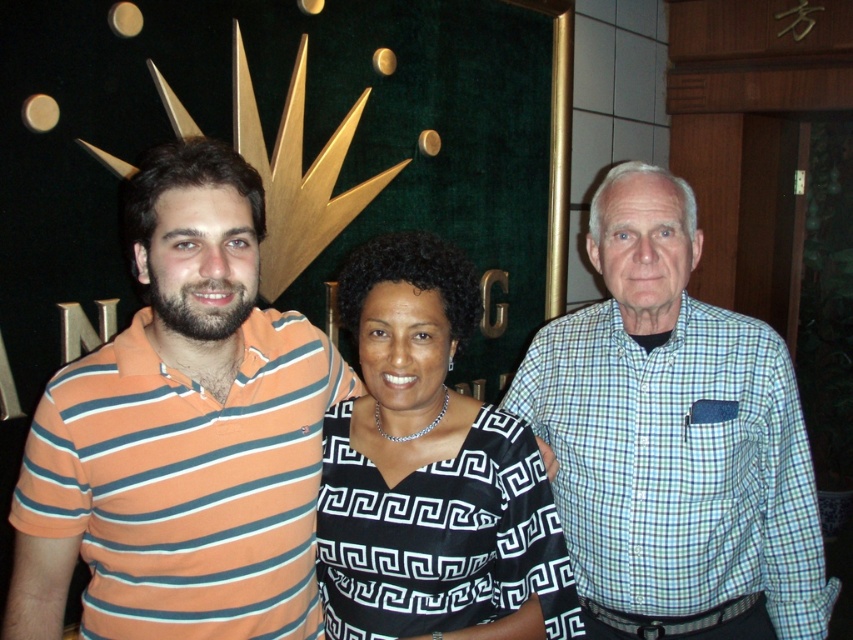
Can you confirm if orange striped polo shirt at left is positioned to the left of light blue checkered shirt at center?

Correct, you'll find orange striped polo shirt at left to the left of light blue checkered shirt at center.

Is orange striped polo shirt at left thinner than light blue checkered shirt at center?

Yes, orange striped polo shirt at left is thinner than light blue checkered shirt at center.

Is point (213, 490) behind point (566, 337)?

No, (213, 490) is closer to viewer.

Locate an element on the screen. orange striped polo shirt at left is located at coordinates (181, 435).

Between light blue checkered shirt at center and black silk dress at center, which one appears on the right side from the viewer's perspective?

From the viewer's perspective, light blue checkered shirt at center appears more on the right side.

Where is `light blue checkered shirt at center`? The width and height of the screenshot is (853, 640). light blue checkered shirt at center is located at coordinates (672, 440).

Consider the image. Measure the distance between light blue checkered shirt at center and camera.

The distance of light blue checkered shirt at center from camera is 4.85 feet.

Locate an element on the screen. The image size is (853, 640). light blue checkered shirt at center is located at coordinates (672, 440).

Describe the element at coordinates (181, 435) in the screenshot. I see `orange striped polo shirt at left` at that location.

This screenshot has height=640, width=853. In order to click on orange striped polo shirt at left in this screenshot , I will do `click(181, 435)`.

I want to click on orange striped polo shirt at left, so click(181, 435).